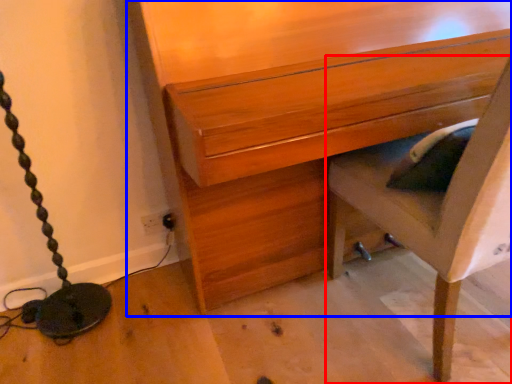
Question: Which of the following is the closest to the observer, furniture (highlighted by a red box) or chest of drawers (highlighted by a blue box)?

Choices:
 (A) furniture
 (B) chest of drawers

Answer: (A)